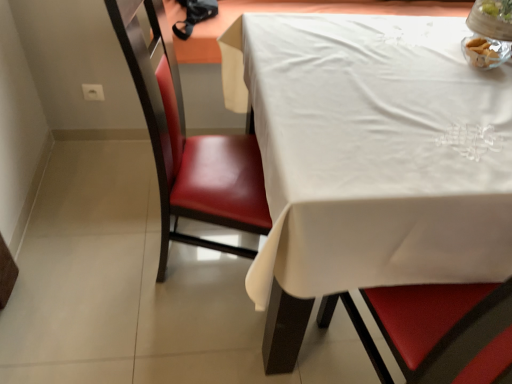
Question: Is clear glass bowl at upper right at the back of white cloth at upper right?

Choices:
 (A) no
 (B) yes

Answer: (A)

Question: Can you confirm if white cloth at upper right is positioned to the right of clear glass bowl at upper right?

Choices:
 (A) yes
 (B) no

Answer: (B)

Question: Does white cloth at upper right have a lesser height compared to clear glass bowl at upper right?

Choices:
 (A) no
 (B) yes

Answer: (A)

Question: Is white cloth at upper right smaller than clear glass bowl at upper right?

Choices:
 (A) yes
 (B) no

Answer: (B)

Question: Considering the relative positions of white cloth at upper right and clear glass bowl at upper right in the image provided, is white cloth at upper right in front of clear glass bowl at upper right?

Choices:
 (A) yes
 (B) no

Answer: (A)

Question: Could you tell me if white cloth at upper right is facing clear glass bowl at upper right?

Choices:
 (A) no
 (B) yes

Answer: (A)

Question: From a real-world perspective, is leather at left on clear glass bowl at upper right?

Choices:
 (A) yes
 (B) no

Answer: (B)

Question: Can you confirm if leather at left is shorter than clear glass bowl at upper right?

Choices:
 (A) yes
 (B) no

Answer: (B)

Question: Is leather at left far from clear glass bowl at upper right?

Choices:
 (A) no
 (B) yes

Answer: (A)

Question: Is leather at left aimed at clear glass bowl at upper right?

Choices:
 (A) no
 (B) yes

Answer: (A)

Question: Is leather at left not within clear glass bowl at upper right?

Choices:
 (A) yes
 (B) no

Answer: (A)

Question: From a real-world perspective, is leather at left below clear glass bowl at upper right?

Choices:
 (A) no
 (B) yes

Answer: (B)

Question: Is clear glass bowl at upper right outside of white cloth at upper right?

Choices:
 (A) yes
 (B) no

Answer: (A)